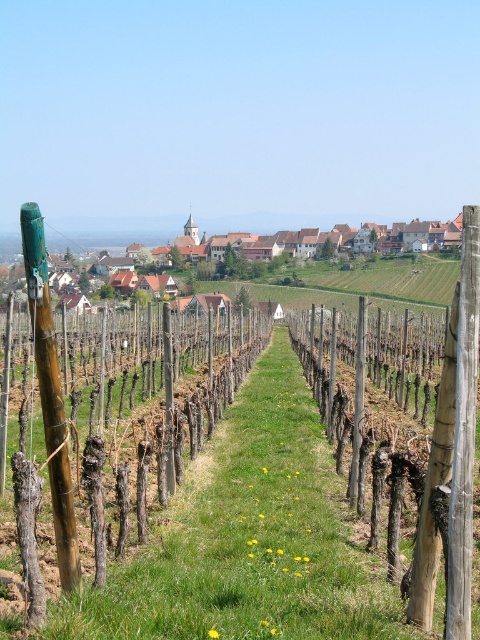
Question: Which of the following is the closest to the observer?

Choices:
 (A) brown wooden fence at center
 (B) green bamboo pole at left

Answer: (A)

Question: Which of the following is the closest to the observer?

Choices:
 (A) (311, 408)
 (B) (58, 445)
 (C) (467, 618)

Answer: (C)

Question: From the image, what is the correct spatial relationship of brown wooden fence at center in relation to wooden post at center?

Choices:
 (A) left
 (B) right

Answer: (A)

Question: Is wooden post at center positioned in front of brown wooden houses at center?

Choices:
 (A) yes
 (B) no

Answer: (A)

Question: Estimate the real-world distances between objects in this image. Which object is closer to the brown wooden fence at center?

Choices:
 (A) brown wooden houses at center
 (B) green bamboo pole at left
 (C) wooden post at center

Answer: (B)

Question: Is wooden post at center positioned behind brown wooden houses at center?

Choices:
 (A) yes
 (B) no

Answer: (B)